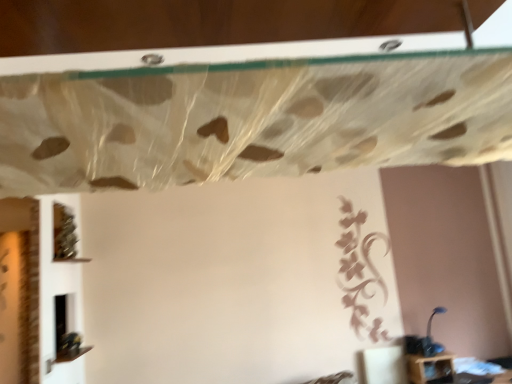
Question: From a real-world perspective, is blue plastic lamp at lower right above or below translucent plastic curtain at upper center?

Choices:
 (A) above
 (B) below

Answer: (B)

Question: Considering the positions of blue plastic lamp at lower right and translucent plastic curtain at upper center in the image, is blue plastic lamp at lower right wider or thinner than translucent plastic curtain at upper center?

Choices:
 (A) thin
 (B) wide

Answer: (A)

Question: Estimate the real-world distances between objects in this image. Which object is closer to the blue plastic lamp at lower right?

Choices:
 (A) translucent plastic curtain at upper center
 (B) green matte vine at lower left

Answer: (B)

Question: Based on their relative distances, which object is farther from the blue plastic lamp at lower right?

Choices:
 (A) translucent plastic curtain at upper center
 (B) green matte vine at lower left

Answer: (A)